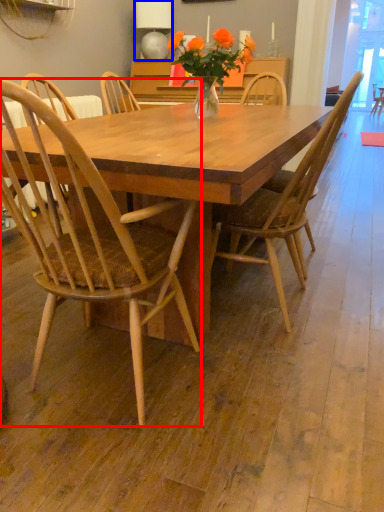
Question: Which object is closer to the camera taking this photo, chair (highlighted by a red box) or lamp (highlighted by a blue box)?

Choices:
 (A) chair
 (B) lamp

Answer: (A)